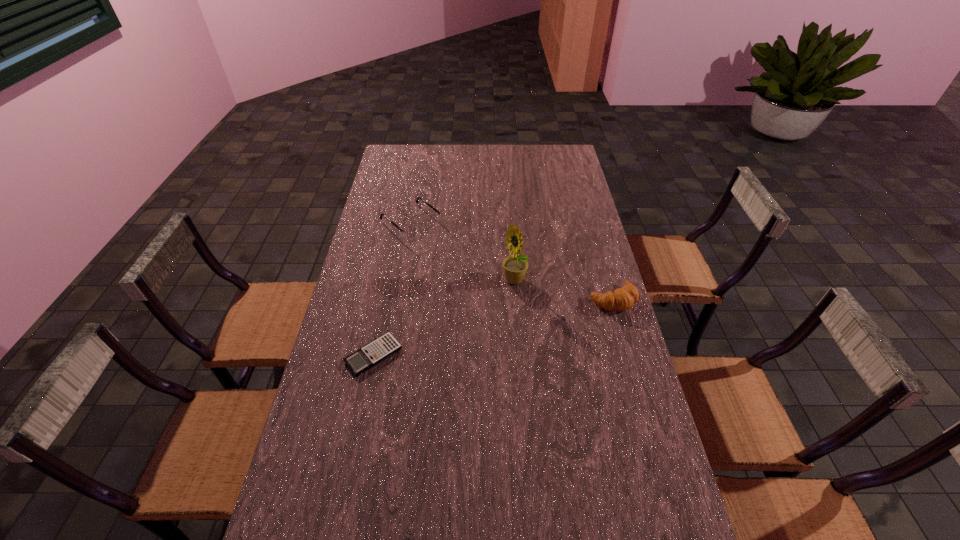
Locate an element on the screen. vacant point located 0.290m on the face of the tallest object is located at coordinates (467, 353).

You are a GUI agent. You are given a task and a screenshot of the screen. Output one action in this format:
    pyautogui.click(x=<x>, y=<y>)
    Task: Click on the free space located at the hinge ends of the spectacles
    The width and height of the screenshot is (960, 540).
    Given the screenshot: What is the action you would take?
    pyautogui.click(x=485, y=285)

You are a GUI agent. You are given a task and a screenshot of the screen. Output one action in this format:
    pyautogui.click(x=<x>, y=<y>)
    Task: Click on the blank area located at the hinge ends of the spectacles
    
    Given the screenshot: What is the action you would take?
    pyautogui.click(x=460, y=264)

You are a GUI agent. You are given a task and a screenshot of the screen. Output one action in this format:
    pyautogui.click(x=<x>, y=<y>)
    Task: Click on the vacant space located at the hinge ends of the spectacles
    This screenshot has height=540, width=960.
    Given the screenshot: What is the action you would take?
    pyautogui.click(x=440, y=247)

This screenshot has width=960, height=540. What are the coordinates of `calculator that is at the left edge` in the screenshot? It's located at (385, 346).

The image size is (960, 540). I want to click on spectacles that is positioned at the left edge, so click(x=410, y=232).

This screenshot has width=960, height=540. Identify the location of object that is at the right edge. (624, 298).

What are the coordinates of `blank area at the far edge` in the screenshot? It's located at (436, 158).

Where is `vacant space at the left edge of the desktop`? This screenshot has height=540, width=960. vacant space at the left edge of the desktop is located at coordinates (415, 180).

You are a GUI agent. You are given a task and a screenshot of the screen. Output one action in this format:
    pyautogui.click(x=<x>, y=<y>)
    Task: Click on the free space at the right edge of the desktop
    The height and width of the screenshot is (540, 960).
    Given the screenshot: What is the action you would take?
    pyautogui.click(x=544, y=172)